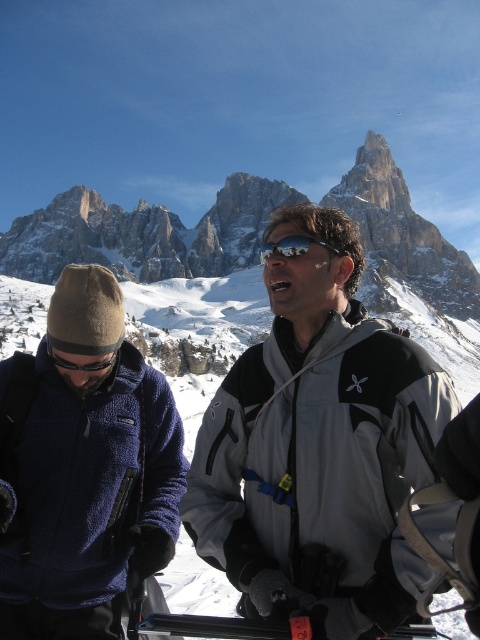
Looking at this image, you are a photographer trying to capture a photo of the blue fleece jacket at left and the shiny reflective sunglasses at center. The problem is that the sunglasses are reflecting too much light, making it hard to see the details. Which object should you move closer to the light source to reduce the reflection?

The shiny reflective sunglasses at center should be moved closer to the light source. Since the blue fleece jacket at left is much taller than the sunglasses, positioning the sunglasses closer to the light can help reduce reflections by ensuring even lighting and minimizing glare.

You are a photographer trying to capture the blue fleece jacket at left in the center of your photo. Given the jacket is at coordinate point 0.734, 0.175, would you need to move your camera to the left or right to center it?

To center the blue fleece jacket at left, you should move the camera to the right since the jacket is located at coordinate point (84, 468), which is to the left of the center.